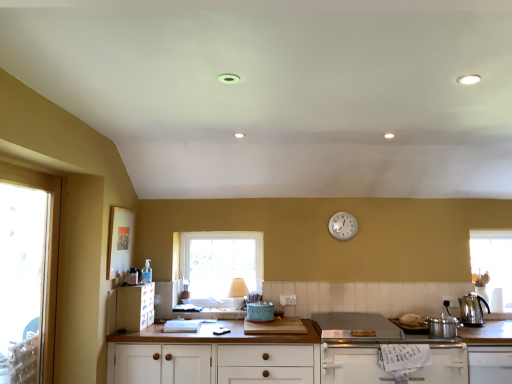
You are a GUI agent. You are given a task and a screenshot of the screen. Output one action in this format:
    pyautogui.click(x=<x>, y=<y>)
    Task: Click on the free space to the right of stainless steel kettle at right
    The image size is (512, 384).
    Given the screenshot: What is the action you would take?
    pyautogui.click(x=500, y=321)